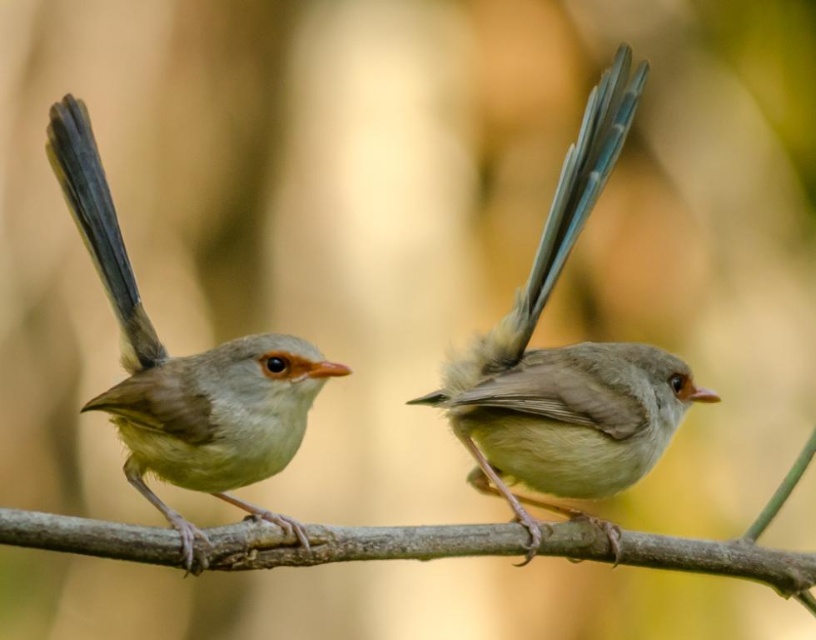
You are a birdwatcher trying to capture both birds in a single photo. Your camera has a 100mm lens that can focus on objects within a 15 inch range. Can you fit both the smooth gray bird at center and the smooth brown bird at left into the frame without moving the camera?

The distance between the smooth gray bird at center and the smooth brown bird at left is 20.12 inches. Since your camera lens can only focus within a 15 inch range, you cannot fit both birds into the frame without moving the camera.

You are a birdwatcher observing the scene. You notice the smooth brown bird at left and the brown smooth branch at center. Which object is taller in this image?

The smooth brown bird at left is taller than the brown smooth branch at center.

You are a photographer trying to capture both the smooth gray bird at center and the brown smooth branch at center in a single frame. Based on their sizes, which object should you focus on to ensure both fit comfortably in the photo?

The smooth gray bird at center occupies less space than the brown smooth branch at center, so focusing on the brown smooth branch at center will ensure both fit comfortably in the photo.